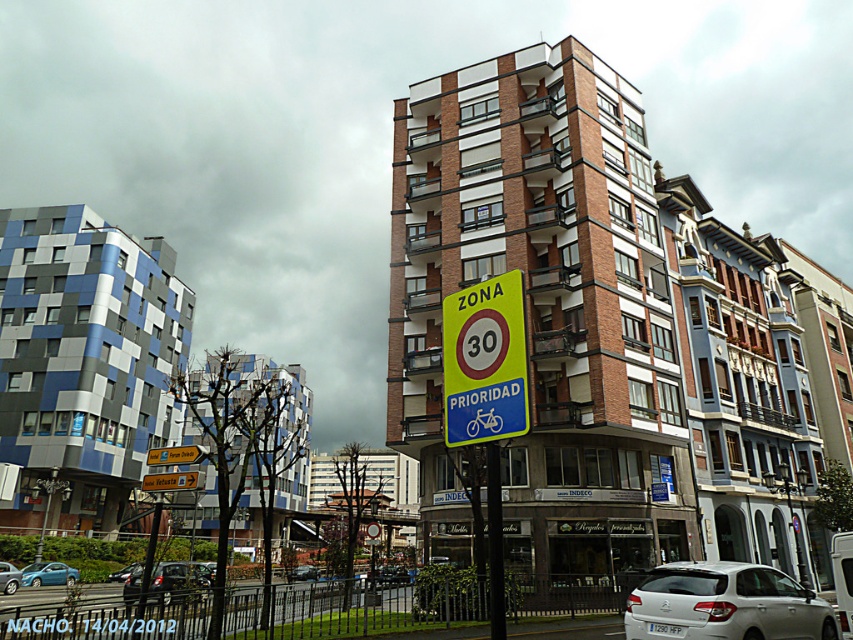
You are a pedestrian standing at the crosswalk in the urban street scene. You see a matte blue car at center and a shiny black sedan at center. Which vehicle is closer to you?

The matte blue car at center is shorter than the shiny black sedan at center, so the shiny black sedan at center is closer to you.

You are a pedestrian crossing the street and see the metallic silver car at lower left and the shiny black sedan at center. Which vehicle should you be more cautious of due to its size?

The metallic silver car at lower left is larger in size than the shiny black sedan at center, so you should be more cautious of the metallic silver car at lower left.

You are a delivery driver navigating through an urban area. You see a matte blue car at center. Based on its position, can you estimate whether it is parked or moving?

The matte blue car at center is positioned at point (9, 577), which likely indicates it is parked since it is at a specific coordinate point.